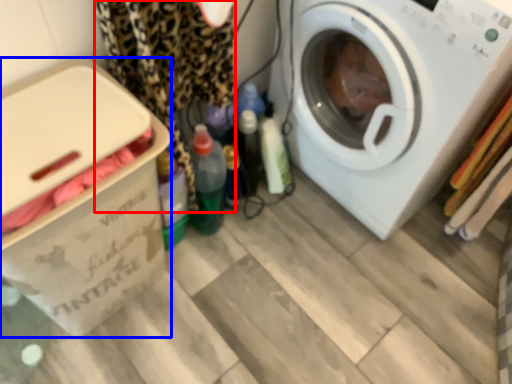
Question: Which object appears farthest to the camera in this image, clothing (highlighted by a red box) or cardboard box (highlighted by a blue box)?

Choices:
 (A) clothing
 (B) cardboard box

Answer: (A)